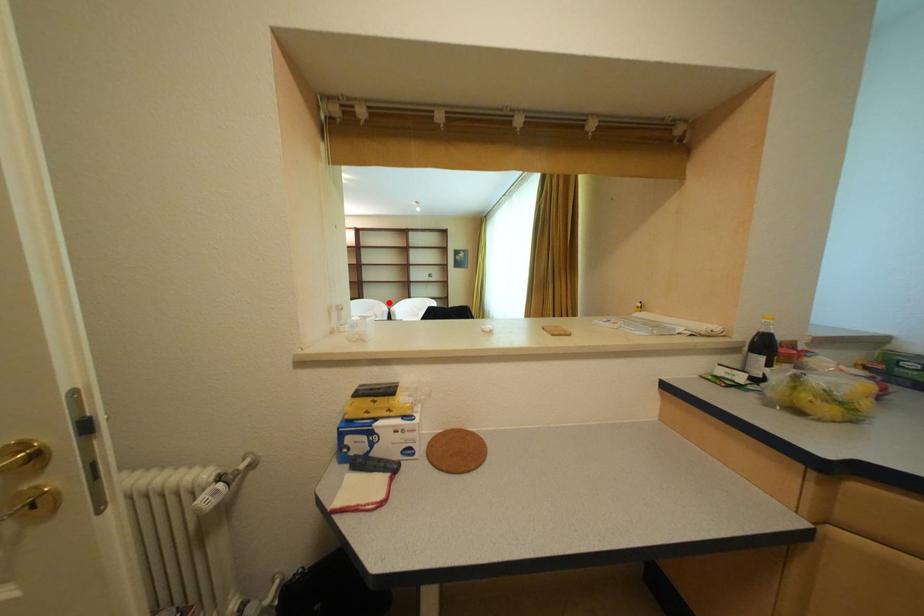
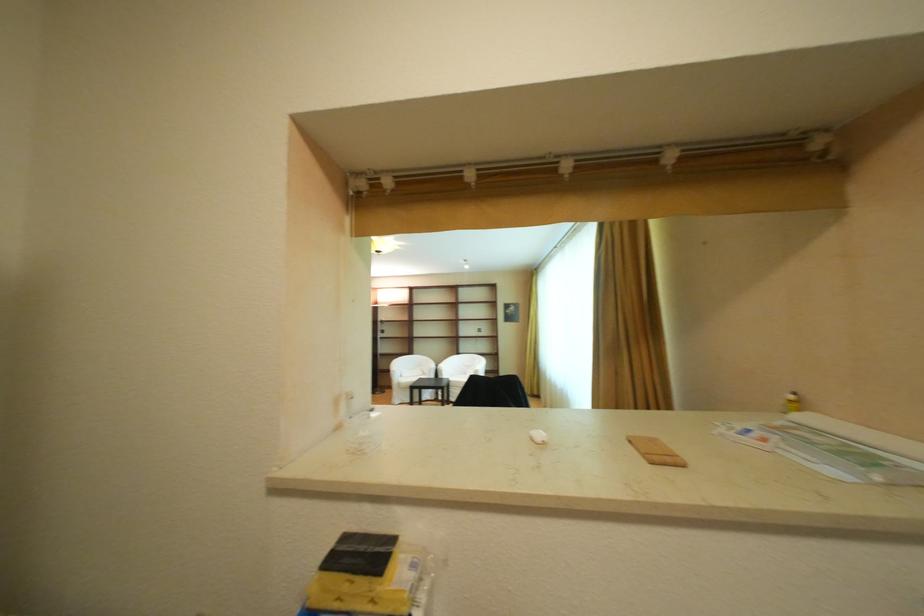
Locate, in the second image, the point that corresponds to the highlighted location in the first image.

(436, 359)